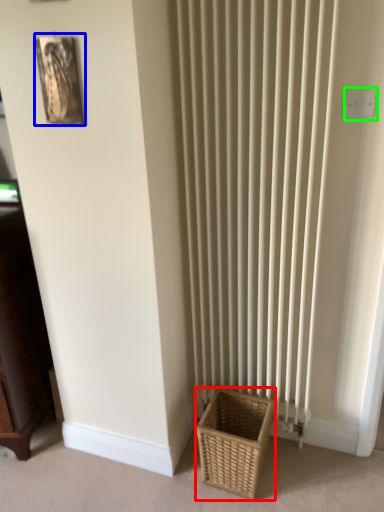
Question: Which object is positioned closest to basket (highlighted by a red box)? Select from picture frame (highlighted by a blue box) and electric outlet (highlighted by a green box).

Choices:
 (A) picture frame
 (B) electric outlet

Answer: (B)